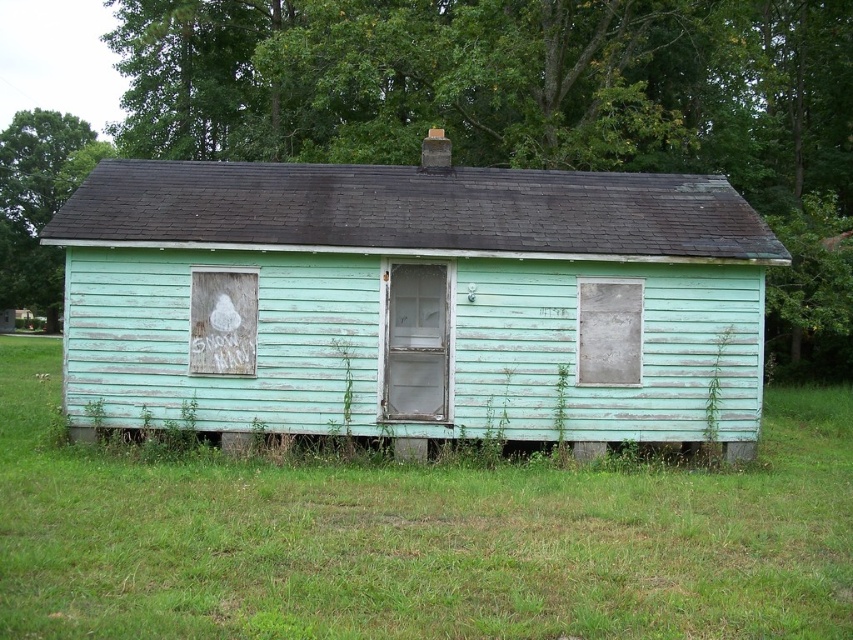
Can you confirm if white chalkboard at left is positioned to the right of metallic gray door at center?

In fact, white chalkboard at left is to the left of metallic gray door at center.

Who is positioned more to the left, white chalkboard at left or metallic gray door at center?

white chalkboard at left is more to the left.

Locate an element on the screen. Image resolution: width=853 pixels, height=640 pixels. white chalkboard at left is located at coordinates (222, 323).

Can you confirm if transparent glass door at center is shorter than white chalkboard at left?

No.

Describe the element at coordinates (415, 340) in the screenshot. I see `transparent glass door at center` at that location.

You are a GUI agent. You are given a task and a screenshot of the screen. Output one action in this format:
    pyautogui.click(x=<x>, y=<y>)
    Task: Click on the transparent glass door at center
    
    Given the screenshot: What is the action you would take?
    pyautogui.click(x=415, y=340)

Who is higher up, light green wood hut at center or transparent glass door at center?

light green wood hut at center is above.

Between point (180, 216) and point (389, 289), which one is positioned behind?

The point (180, 216) is more distant.

The height and width of the screenshot is (640, 853). In order to click on light green wood hut at center in this screenshot , I will do `click(384, 292)`.